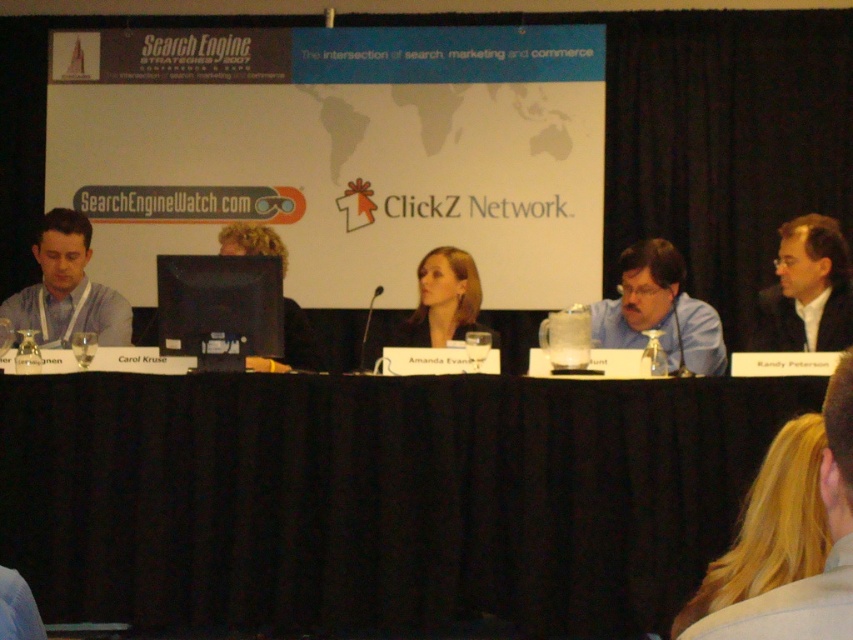
Does dark suit at right appear over matte gray shirt at left?

Yes.

Describe the element at coordinates (807, 291) in the screenshot. I see `dark suit at right` at that location.

The image size is (853, 640). I want to click on dark suit at right, so click(x=807, y=291).

Does blonde hair at lower right have a greater width compared to smooth brown hair at center?

In fact, blonde hair at lower right might be narrower than smooth brown hair at center.

Is blonde hair at lower right thinner than smooth brown hair at center?

Yes, blonde hair at lower right is thinner than smooth brown hair at center.

At what (x,y) coordinates should I click in order to perform the action: click on blonde hair at lower right. Please return your answer as a coordinate pair (x, y). The width and height of the screenshot is (853, 640). Looking at the image, I should click on (770, 525).

Between black fabric table at center and blonde hair at lower right, which one appears on the left side from the viewer's perspective?

Positioned to the left is black fabric table at center.

Based on the photo, does black fabric table at center appear on the right side of blonde hair at lower right?

No, black fabric table at center is not to the right of blonde hair at lower right.

I want to click on black fabric table at center, so click(376, 497).